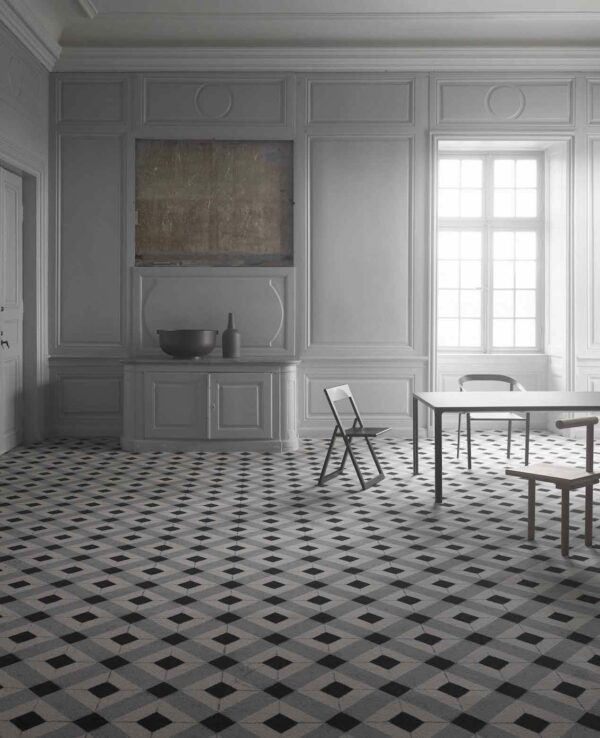
Identify the location of chair. (344, 437), (548, 469), (486, 418).